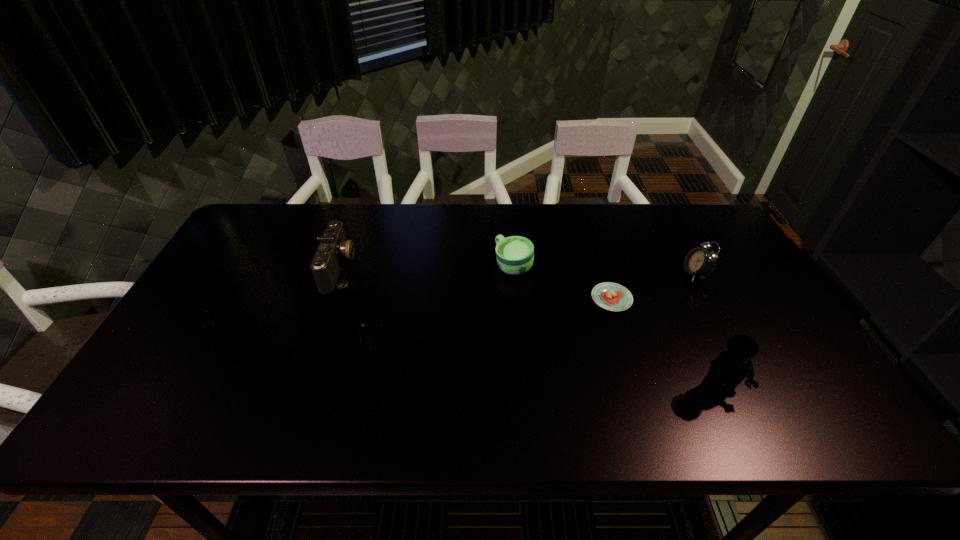
Please point a location where one more Lego can be added evenly. Please provide its 2D coordinates. Your answer should be formatted as a tuple, i.e. [(x, y)], where the tuple contains the x and y coordinates of a point satisfying the conditions above.

[(538, 369)]